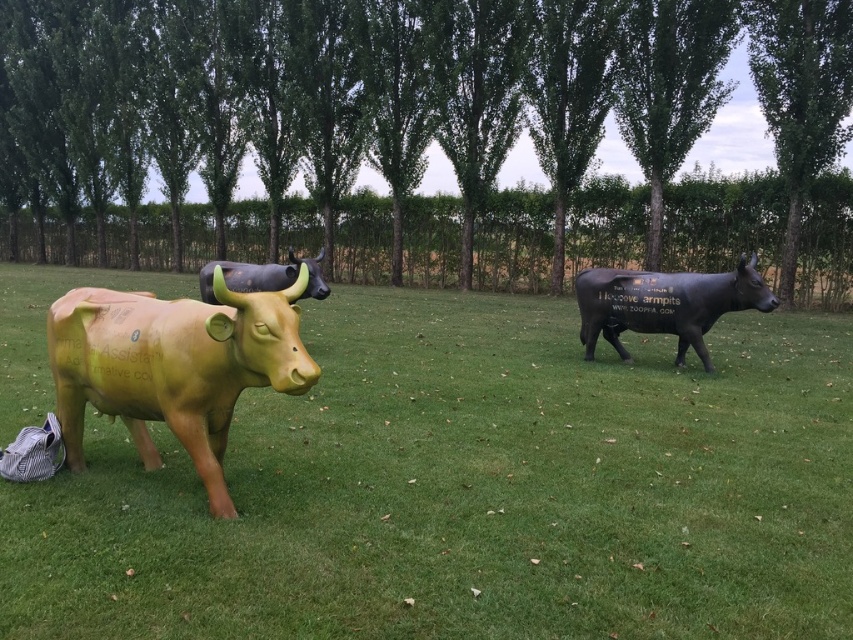
Where is the matte yellow bull at left located in the image?

The matte yellow bull at left is located at point (x=173, y=365).

You are a gardener planning to mow the lawn. You notice the green grass at center and the matte black bull at right. Which area is wider and requires more time to mow?

The green grass at center is wider than the matte black bull at right, so it requires more time to mow.